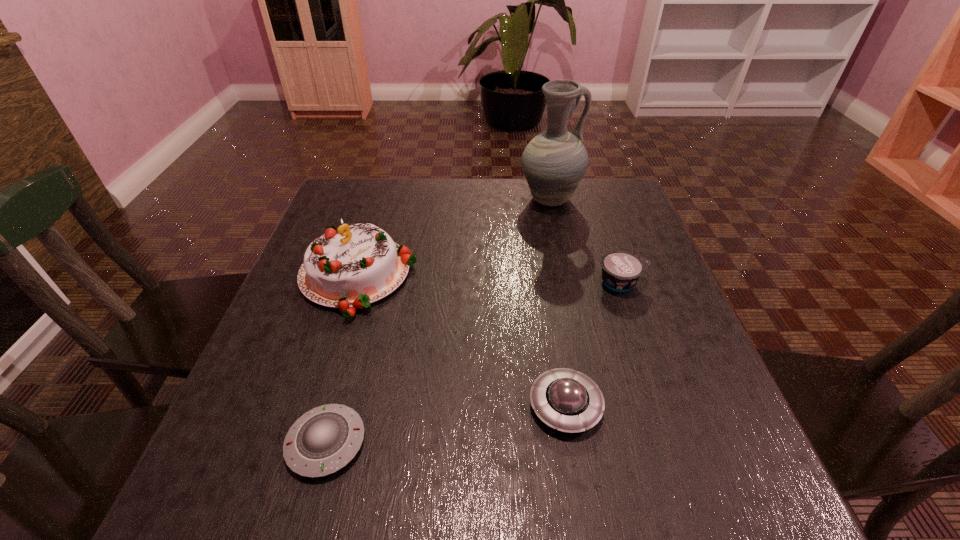
The width and height of the screenshot is (960, 540). In order to click on the tallest object in this screenshot , I will do `click(554, 162)`.

Find the location of a particular element. the farthest object is located at coordinates (554, 162).

In order to click on the second tallest object in this screenshot , I will do `click(351, 267)`.

This screenshot has width=960, height=540. Identify the location of the right saucer. (570, 401).

Image resolution: width=960 pixels, height=540 pixels. Find the location of `yogurt`. yogurt is located at coordinates (621, 270).

Locate an element on the screen. the shortest object is located at coordinates (325, 439).

In order to click on the left saucer in this screenshot , I will do `click(325, 439)`.

The image size is (960, 540). I want to click on free spot located 0.050m on the handle side of the farthest object, so click(599, 200).

The height and width of the screenshot is (540, 960). What are the coordinates of `vacant space situated 0.150m on the back of the cake` in the screenshot? It's located at (379, 206).

Locate an element on the screen. vacant space located on the right of the taller saucer is located at coordinates (696, 406).